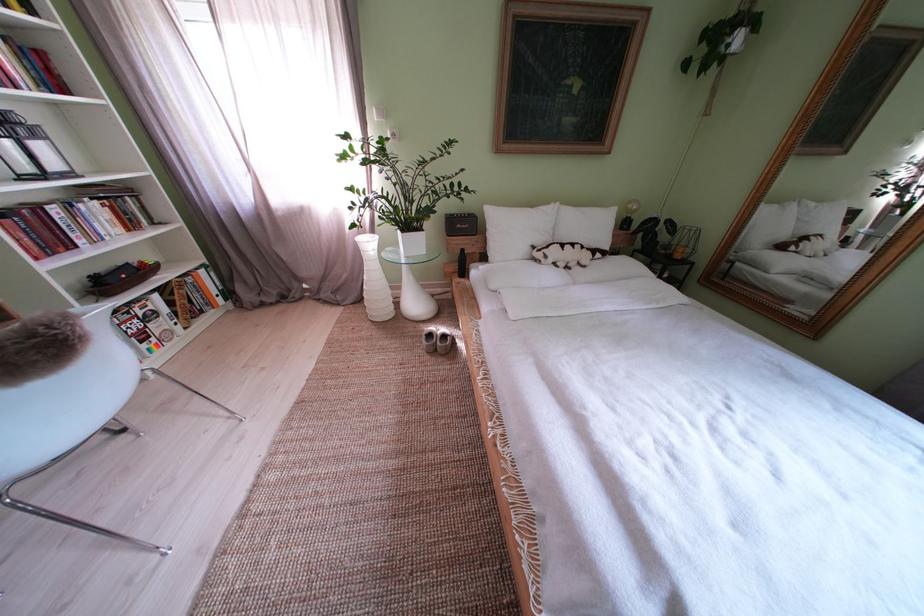
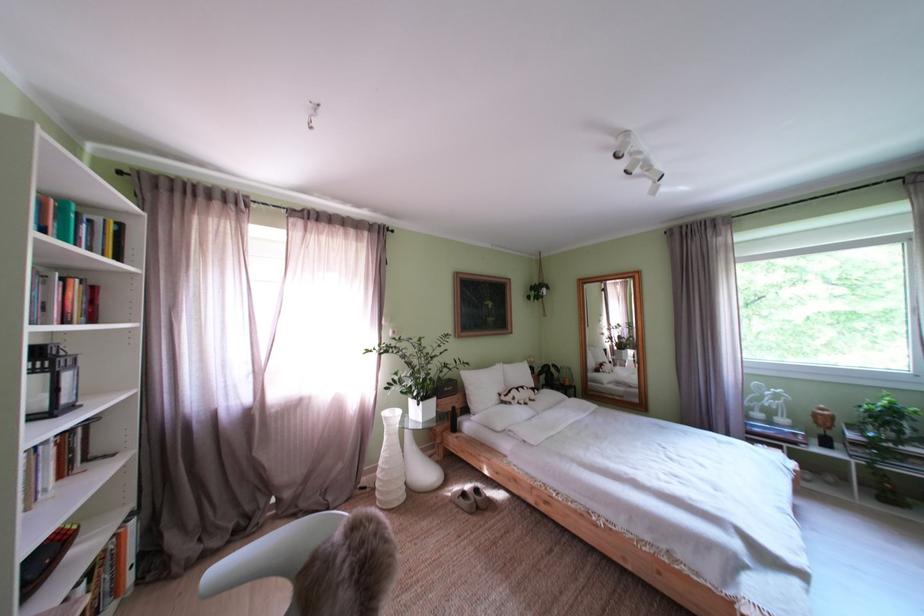
Where in the second image is the point corresponding to the point at 442,341 from the first image?

(475, 500)